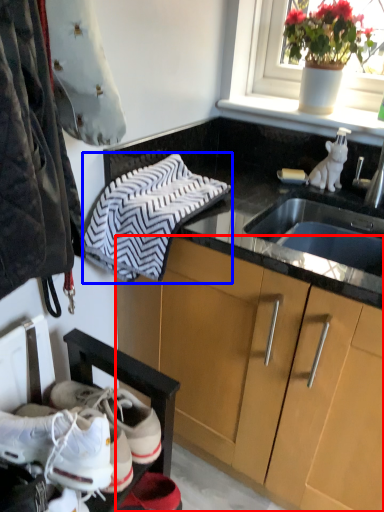
Question: Which point is further to the camera, cabinetry (highlighted by a red box) or hand towel (highlighted by a blue box)?

Choices:
 (A) cabinetry
 (B) hand towel

Answer: (B)